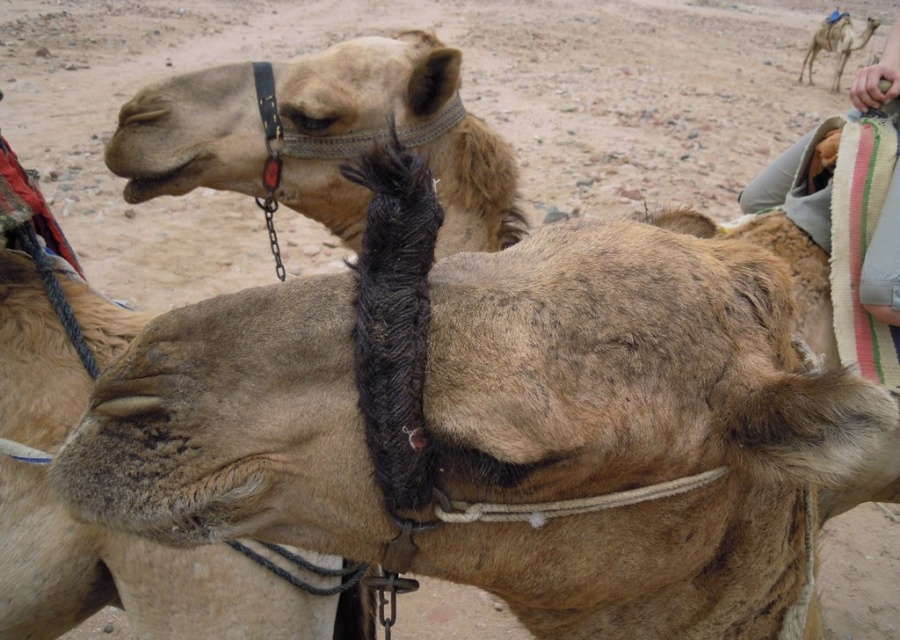
The image size is (900, 640). Describe the element at coordinates (135, 579) in the screenshot. I see `fuzzy beige camel at center` at that location.

Consider the image. Does fuzzy beige camel at center appear on the right side of striped fabric cushion at upper right?

Incorrect, fuzzy beige camel at center is not on the right side of striped fabric cushion at upper right.

Find the location of `fuzzy beige camel at center`. fuzzy beige camel at center is located at coordinates (135, 579).

Identify the location of fuzzy beige camel at center. (135, 579).

Based on the photo, which is more to the right, fuzzy beige camel at center or light brown fur at upper right?

From the viewer's perspective, light brown fur at upper right appears more on the right side.

Is fuzzy beige camel at center positioned at the back of light brown fur at upper right?

No.

Which is behind, point (245, 620) or point (869, 35)?

The point (869, 35) is more distant.

Find the location of a particular element. This screenshot has width=900, height=640. fuzzy beige camel at center is located at coordinates (135, 579).

Between point (742, 195) and point (815, 54), which one is positioned in front?

Point (742, 195) is more forward.

Is striped fabric cushion at upper right shorter than light brown fur at upper right?

No, striped fabric cushion at upper right is not shorter than light brown fur at upper right.

Does point (891, 292) come in front of point (801, 77)?

Yes.

Image resolution: width=900 pixels, height=640 pixels. What are the coordinates of `striped fabric cushion at upper right` in the screenshot? It's located at (883, 260).